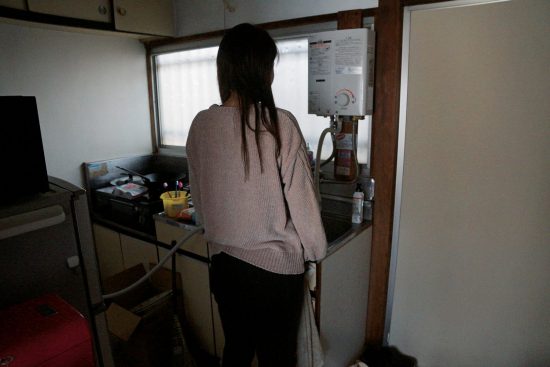
Find the location of a particular element. Image resolution: width=550 pixels, height=367 pixels. toothbrushes in container is located at coordinates (166, 188).